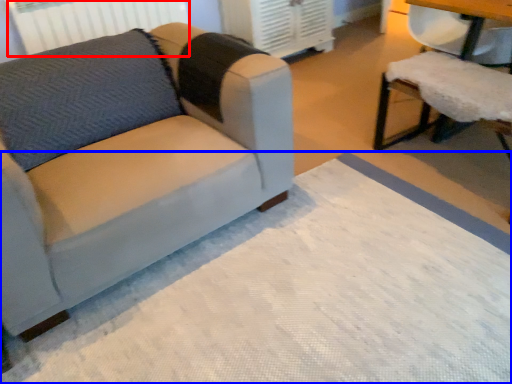
Question: Which object is further to the camera taking this photo, radiator (highlighted by a red box) or mat (highlighted by a blue box)?

Choices:
 (A) radiator
 (B) mat

Answer: (A)